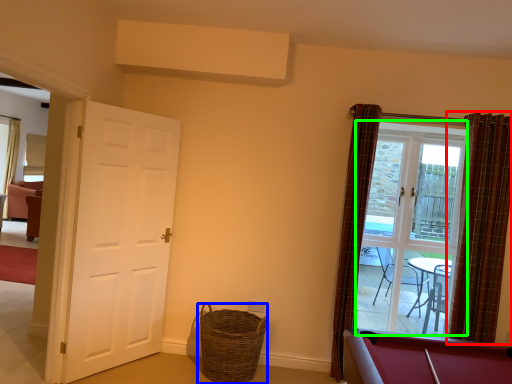
Question: Based on their relative distances, which object is nearer to curtain (highlighted by a red box)? Choose from basket (highlighted by a blue box) and glass door (highlighted by a green box).

Choices:
 (A) basket
 (B) glass door

Answer: (B)